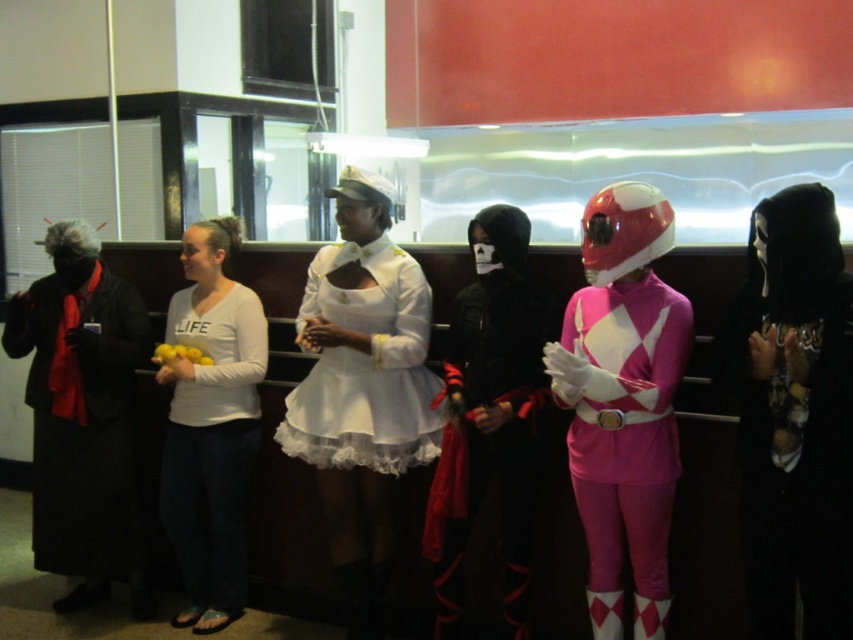
Consider the image. Is white satin dress at center to the left of white cotton shirt at center from the viewer's perspective?

No, white satin dress at center is not to the left of white cotton shirt at center.

Looking at this image, is white satin dress at center positioned in front of white cotton shirt at center?

Yes, white satin dress at center is closer to the viewer.

The width and height of the screenshot is (853, 640). What do you see at coordinates (363, 388) in the screenshot? I see `white satin dress at center` at bounding box center [363, 388].

You are a GUI agent. You are given a task and a screenshot of the screen. Output one action in this format:
    pyautogui.click(x=<x>, y=<y>)
    Task: Click on the white satin dress at center
    
    Given the screenshot: What is the action you would take?
    pyautogui.click(x=363, y=388)

Is point (579, 486) behind point (187, 273)?

No, it is in front of (187, 273).

Who is positioned more to the left, pink shiny power ranger suit at center or white cotton shirt at center?

white cotton shirt at center is more to the left.

This screenshot has height=640, width=853. Find the location of `pink shiny power ranger suit at center`. pink shiny power ranger suit at center is located at coordinates (624, 436).

This screenshot has width=853, height=640. What are the coordinates of `pink shiny power ranger suit at center` in the screenshot? It's located at (624, 436).

Consider the image. Does black velvet mask at center have a smaller size compared to black matte coat at left?

Indeed, black velvet mask at center has a smaller size compared to black matte coat at left.

Consider the image. Does black velvet mask at center appear on the right side of black matte coat at left?

Correct, you'll find black velvet mask at center to the right of black matte coat at left.

This screenshot has height=640, width=853. Identify the location of black velvet mask at center. (793, 413).